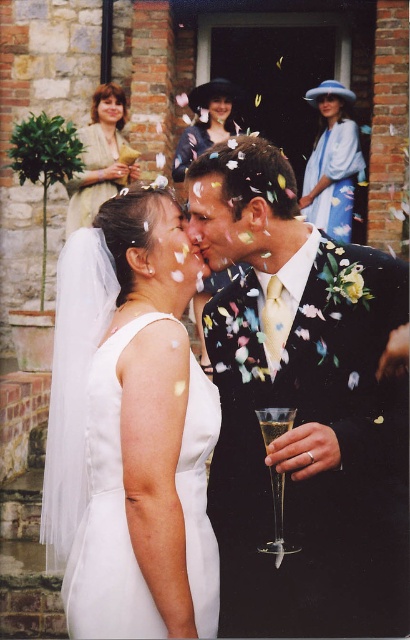
In the wedding scene, you are a photographer who needs to capture a photo of the white satin dress at center and the matte beige dress at upper left. Considering their heights, which dress should you adjust your camera angle to focus on to ensure both are visible in the frame?

The white satin dress at center is taller than the matte beige dress at upper left. To ensure both are visible, adjust the camera angle to focus on the white satin dress at center first, then lower slightly to include the shorter matte beige dress at upper left in the frame.

You are a photographer standing at the edge of the wedding scene. You need to capture a photo that includes both the white satin dress at center and the matte beige dress at upper left. Considering their distance, what is the minimum focal length lens you should use to ensure both dresses are in frame?

The white satin dress at center and the matte beige dress at upper left are 5.22 meters apart. To capture both in frame, the photographer should use a wide angle lens with a focal length of 35mm or lower to accommodate the distance between them.